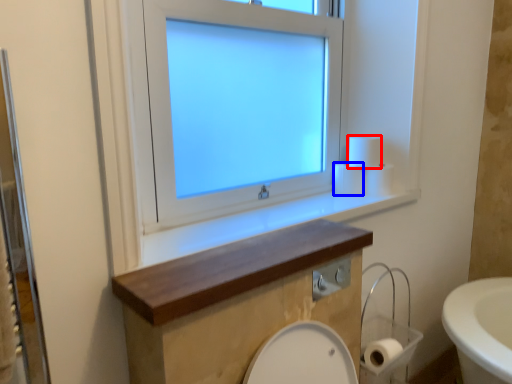
Question: Which of the following is the closest to the observer, toilet paper (highlighted by a red box) or toilet paper (highlighted by a blue box)?

Choices:
 (A) toilet paper
 (B) toilet paper

Answer: (A)